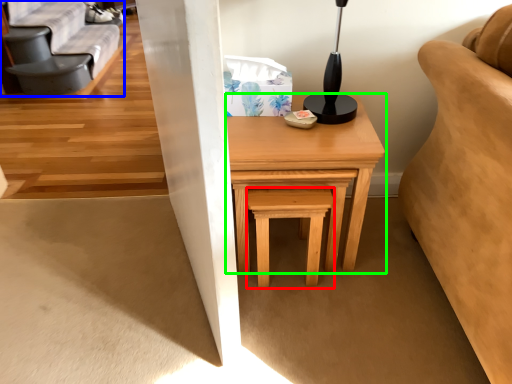
Question: Estimate the real-world distances between objects in this image. Which object is farther from stool (highlighted by a red box), futon (highlighted by a blue box) or table (highlighted by a green box)?

Choices:
 (A) futon
 (B) table

Answer: (A)